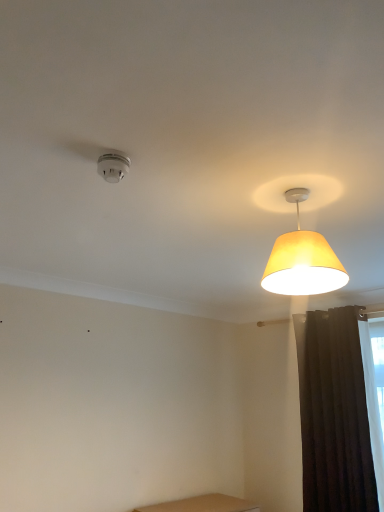
Question: Is dark matte curtain at right placed right next to yellow fabric lampshade at upper right, which appears as the 2th lamp when viewed from the left?

Choices:
 (A) yes
 (B) no

Answer: (B)

Question: Is the position of dark matte curtain at right more distant than that of yellow fabric lampshade at upper right, the 1th lamp from the right?

Choices:
 (A) yes
 (B) no

Answer: (A)

Question: Considering the relative sizes of dark matte curtain at right and yellow fabric lampshade at upper right, which appears as the 2th lamp when viewed from the left, in the image provided, is dark matte curtain at right shorter than yellow fabric lampshade at upper right, which appears as the 2th lamp when viewed from the left,?

Choices:
 (A) yes
 (B) no

Answer: (B)

Question: From a real-world perspective, is dark matte curtain at right under yellow fabric lampshade at upper right, the 1th lamp from the right?

Choices:
 (A) yes
 (B) no

Answer: (A)

Question: Does dark matte curtain at right have a larger size compared to yellow fabric lampshade at upper right, which appears as the 2th lamp when viewed from the left?

Choices:
 (A) no
 (B) yes

Answer: (B)

Question: Looking at their shapes, would you say dark matte curtain at right is wider or thinner than yellow fabric lampshade at upper right, the 1th lamp from the right?

Choices:
 (A) thin
 (B) wide

Answer: (A)

Question: Is dark matte curtain at right taller or shorter than yellow fabric lampshade at upper right, the 1th lamp from the right?

Choices:
 (A) short
 (B) tall

Answer: (B)

Question: Choose the correct answer: Is dark matte curtain at right inside yellow fabric lampshade at upper right, the 1th lamp from the right, or outside it?

Choices:
 (A) outside
 (B) inside

Answer: (A)

Question: In terms of size, does dark matte curtain at right appear bigger or smaller than yellow fabric lampshade at upper right, which appears as the 2th lamp when viewed from the left?

Choices:
 (A) big
 (B) small

Answer: (A)

Question: Considering the positions of yellow fabric lampshade at upper right, which appears as the 2th lamp when viewed from the left, and dark matte curtain at right in the image, is yellow fabric lampshade at upper right, which appears as the 2th lamp when viewed from the left, taller or shorter than dark matte curtain at right?

Choices:
 (A) tall
 (B) short

Answer: (B)

Question: Based on their sizes in the image, would you say yellow fabric lampshade at upper right, the 1th lamp from the right, is bigger or smaller than dark matte curtain at right?

Choices:
 (A) small
 (B) big

Answer: (A)

Question: Do you think yellow fabric lampshade at upper right, the 1th lamp from the right, is within dark matte curtain at right, or outside of it?

Choices:
 (A) outside
 (B) inside

Answer: (A)

Question: From a real-world perspective, is yellow fabric lampshade at upper right, which appears as the 2th lamp when viewed from the left, above or below dark matte curtain at right?

Choices:
 (A) below
 (B) above

Answer: (B)

Question: Is dark matte curtain at right spatially inside white plastic smoke detector at upper left, the first lamp viewed from the left, or outside of it?

Choices:
 (A) inside
 (B) outside

Answer: (B)

Question: Based on their positions, is dark matte curtain at right located to the left or right of white plastic smoke detector at upper left, the 2th lamp viewed from the right?

Choices:
 (A) left
 (B) right

Answer: (B)